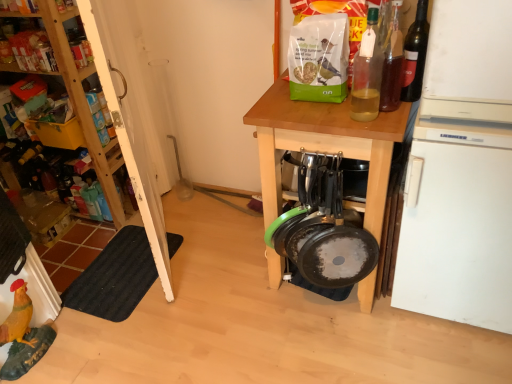
In order to click on free region on the left part of white matte refrigerator at right in this screenshot , I will do `click(353, 343)`.